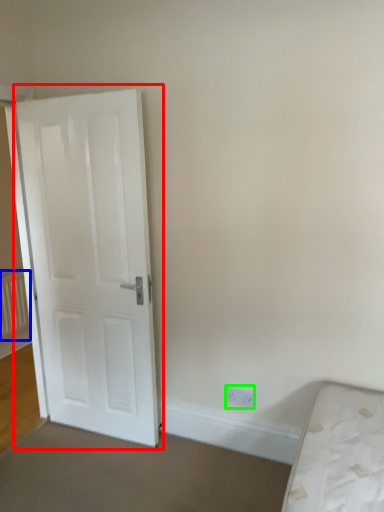
Question: Estimate the real-world distances between objects in this image. Which object is farther from door (highlighted by a red box), radiator (highlighted by a blue box) or electric outlet (highlighted by a green box)?

Choices:
 (A) radiator
 (B) electric outlet

Answer: (A)